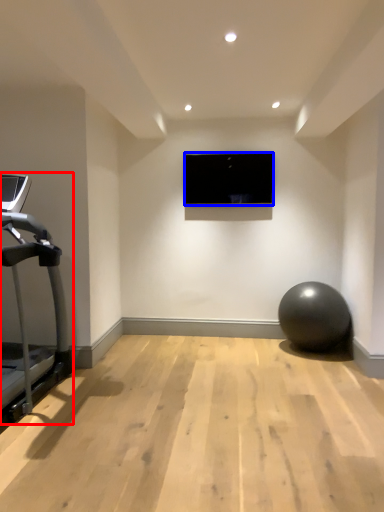
Question: Which of the following is the closest to the observer, treadmill (highlighted by a red box) or computer screen (highlighted by a blue box)?

Choices:
 (A) treadmill
 (B) computer screen

Answer: (A)